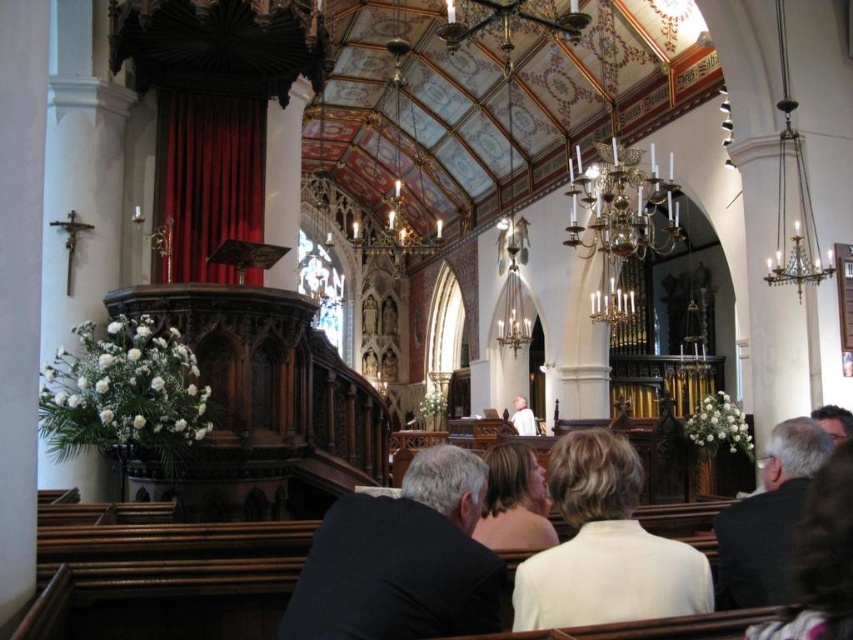
You are standing at the entrance of the church and notice a black fabric at center. Can you determine its exact location using the coordinate system provided?

The black fabric at center is located at point (401, 561).

You are a photographer standing at the back of the church. You want to capture a photo of the black fabric at center and the white fabric at center without any overlap between them. Based on their widths, is this possible?

The black fabric at center might be wider than white fabric at center, so there is a possibility that they could overlap if positioned closely. To ensure no overlap, the photographer should adjust the camera angle or position to account for their potential widths.

You are a photographer standing at the back of the church. You need to capture a photo that includes both the white matte jacket at lower center and the white fabric at center. Which object will appear wider in the photo?

The white matte jacket at lower center will appear wider in the photo because its width surpasses that of the white fabric at center according to the description.